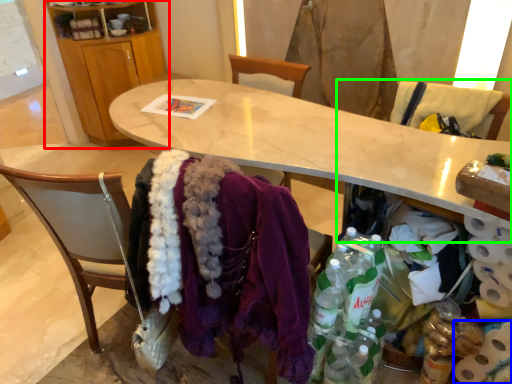
Question: Estimate the real-world distances between objects in this image. Which object is farther from cabinetry (highlighted by a red box), toilet paper (highlighted by a blue box) or armchair (highlighted by a green box)?

Choices:
 (A) toilet paper
 (B) armchair

Answer: (A)